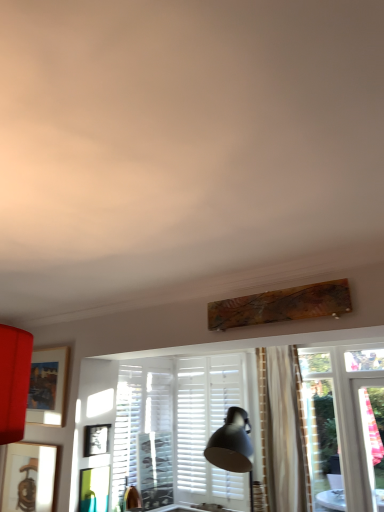
Question: From the image's perspective, does white matte shutter at center appear lower than matte black picture frame at center, marked as the 2th picture frame in a bottom-to-top arrangement?

Choices:
 (A) yes
 (B) no

Answer: (A)

Question: Is matte black picture frame at center, which is counted as the second picture frame, starting from the top, inside white matte shutter at center?

Choices:
 (A) no
 (B) yes

Answer: (A)

Question: Can you confirm if white matte shutter at center is bigger than matte black picture frame at center, which is counted as the second picture frame, starting from the top?

Choices:
 (A) no
 (B) yes

Answer: (B)

Question: Can you confirm if white matte shutter at center is shorter than matte black picture frame at center, which is counted as the second picture frame, starting from the top?

Choices:
 (A) no
 (B) yes

Answer: (A)

Question: Is white matte shutter at center facing towards matte black picture frame at center, which is counted as the second picture frame, starting from the top?

Choices:
 (A) no
 (B) yes

Answer: (A)

Question: Looking at the image, does matte wooden picture frame at left, which ranks as the 1th picture frame in top-to-bottom order, seem bigger or smaller compared to white matte shutter at center?

Choices:
 (A) big
 (B) small

Answer: (B)

Question: In the image, is matte wooden picture frame at left, which ranks as the 1th picture frame in top-to-bottom order, positioned in front of or behind white matte shutter at center?

Choices:
 (A) behind
 (B) front

Answer: (B)

Question: Does point (43, 379) appear closer or farther from the camera than point (140, 409)?

Choices:
 (A) farther
 (B) closer

Answer: (B)

Question: From a real-world perspective, relative to white matte shutter at center, is matte wooden picture frame at left, which ranks as the 1th picture frame in top-to-bottom order, vertically above or below?

Choices:
 (A) above
 (B) below

Answer: (A)

Question: Is matte black picture frame at center, marked as the 2th picture frame in a bottom-to-top arrangement, in front of or behind matte wooden picture frame at left, the third picture frame ordered from the bottom, in the image?

Choices:
 (A) front
 (B) behind

Answer: (A)

Question: Is matte black picture frame at center, which is counted as the second picture frame, starting from the top, to the left or to the right of matte wooden picture frame at left, the third picture frame ordered from the bottom, in the image?

Choices:
 (A) right
 (B) left

Answer: (A)

Question: From a real-world perspective, is matte black picture frame at center, which is counted as the second picture frame, starting from the top, physically located above or below matte wooden picture frame at left, which ranks as the 1th picture frame in top-to-bottom order?

Choices:
 (A) below
 (B) above

Answer: (A)

Question: From the image's perspective, relative to matte wooden picture frame at left, the third picture frame ordered from the bottom, is matte black picture frame at center, marked as the 2th picture frame in a bottom-to-top arrangement, above or below?

Choices:
 (A) below
 (B) above

Answer: (A)

Question: In terms of width, does matte black picture frame at center, which is counted as the second picture frame, starting from the top, look wider or thinner when compared to wooden picture frame at lower left, which is the 1th picture frame from bottom to top?

Choices:
 (A) wide
 (B) thin

Answer: (A)

Question: Based on their positions, is matte black picture frame at center, marked as the 2th picture frame in a bottom-to-top arrangement, located to the left or right of wooden picture frame at lower left, which appears as the third picture frame when viewed from the top?

Choices:
 (A) left
 (B) right

Answer: (B)